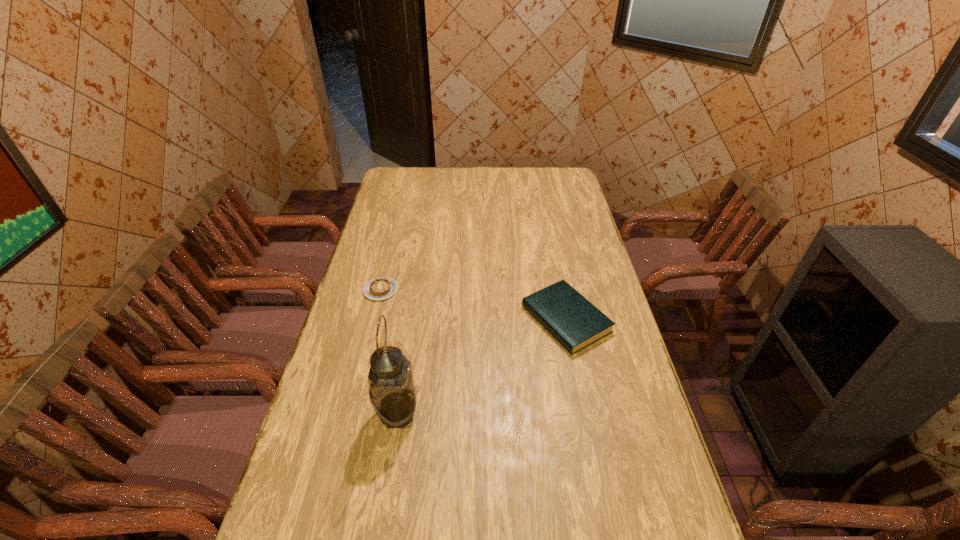
Where is `the tallest object`? The image size is (960, 540). the tallest object is located at coordinates coord(392,393).

The height and width of the screenshot is (540, 960). I want to click on the nearest object, so click(x=392, y=393).

Identify the location of the second shortest object. The image size is (960, 540). (569, 317).

You are a GUI agent. You are given a task and a screenshot of the screen. Output one action in this format:
    pyautogui.click(x=<x>, y=<y>)
    Task: Click on the book
    The width and height of the screenshot is (960, 540).
    Given the screenshot: What is the action you would take?
    pyautogui.click(x=569, y=317)

The width and height of the screenshot is (960, 540). What are the coordinates of `quiche` in the screenshot? It's located at (380, 288).

The height and width of the screenshot is (540, 960). I want to click on the leftmost object, so click(x=380, y=288).

Where is `free point located on the back of the oil lamp`? This screenshot has height=540, width=960. free point located on the back of the oil lamp is located at coordinates (402, 379).

At what (x,y) coordinates should I click in order to perform the action: click on vacant space located 0.150m on the front of the book. Please return your answer as a coordinate pair (x, y). Looking at the image, I should click on 582,398.

The height and width of the screenshot is (540, 960). Identify the location of vacant space located on the front of the leftmost object. (369, 339).

This screenshot has width=960, height=540. In order to click on object located at the left edge in this screenshot , I will do `click(380, 288)`.